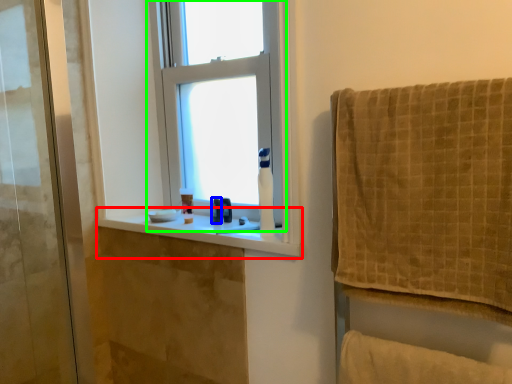
Question: Estimate the real-world distances between objects in this image. Which object is farther from window sill (highlighted by a red box), toiletry (highlighted by a blue box) or window (highlighted by a green box)?

Choices:
 (A) toiletry
 (B) window

Answer: (B)